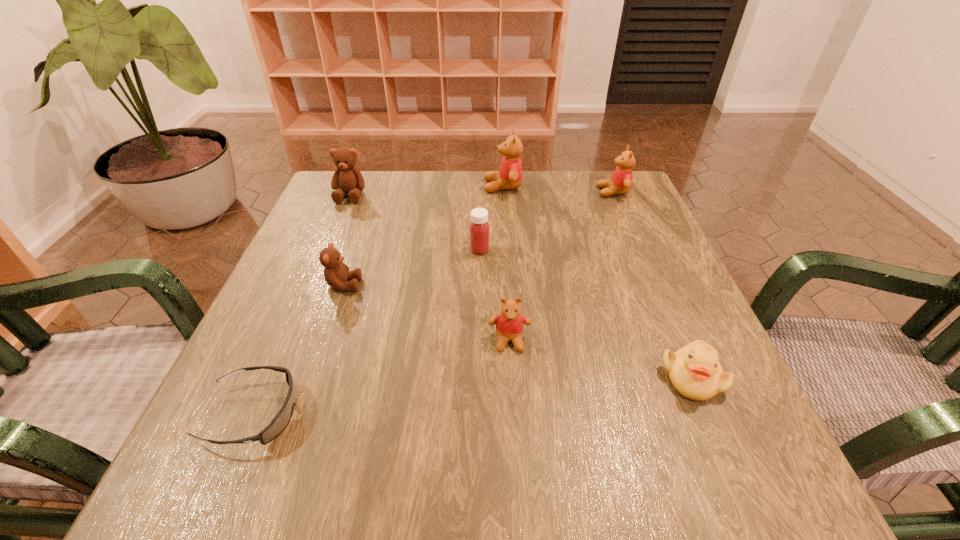
Locate an element on the screen. the biggest red teddy bear is located at coordinates (509, 177).

At what (x,y) coordinates should I click in order to perform the action: click on the tallest object. Please return your answer as a coordinate pair (x, y). The image size is (960, 540). Looking at the image, I should click on (509, 177).

Find the location of a particular element. the second biggest red teddy bear is located at coordinates (621, 180).

Locate an element on the screen. Image resolution: width=960 pixels, height=540 pixels. the rightmost teddy bear is located at coordinates tap(621, 180).

Locate an element on the screen. This screenshot has height=540, width=960. the bigger brown teddy bear is located at coordinates [x=347, y=178].

The width and height of the screenshot is (960, 540). I want to click on red medicine, so click(479, 228).

At what (x,y) coordinates should I click in order to perform the action: click on medicine. Please return your answer as a coordinate pair (x, y). The image size is (960, 540). Looking at the image, I should click on (479, 228).

At what (x,y) coordinates should I click in order to perform the action: click on the smaller brown teddy bear. Please return your answer as a coordinate pair (x, y). Image resolution: width=960 pixels, height=540 pixels. Looking at the image, I should click on (336, 273).

This screenshot has height=540, width=960. Find the location of `the fifth farthest object`. the fifth farthest object is located at coordinates (336, 273).

Find the location of a particular element. Image resolution: width=960 pixels, height=540 pixels. the smallest red teddy bear is located at coordinates (509, 324).